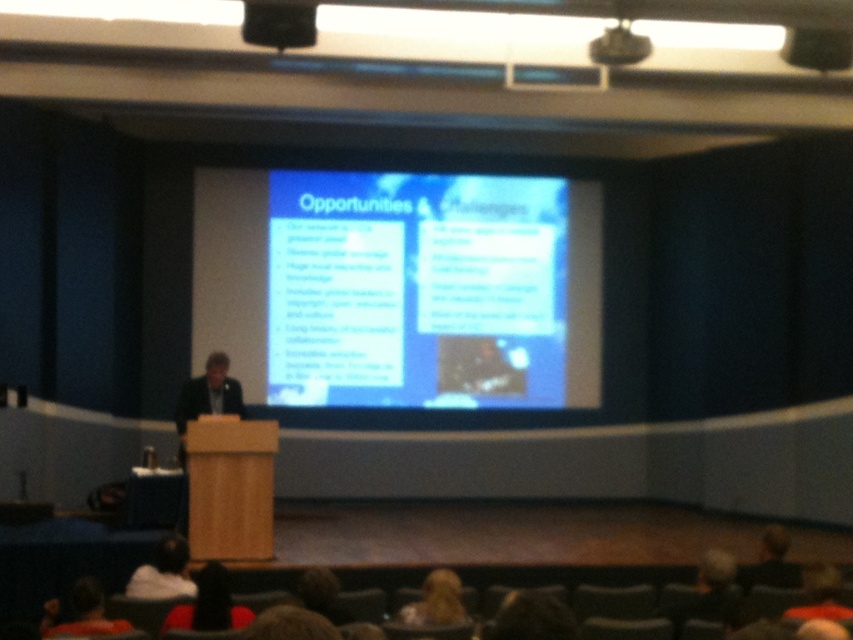
Question: Among these points, which one is farthest from the camera?

Choices:
 (A) (231, 612)
 (B) (450, 595)

Answer: (B)

Question: Does black fabric head at lower center have a smaller size compared to blonde hair at lower center?

Choices:
 (A) no
 (B) yes

Answer: (B)

Question: Is dark suit at center above blonde hair at lower center?

Choices:
 (A) yes
 (B) no

Answer: (A)

Question: Among these objects, which one is nearest to the camera?

Choices:
 (A) blue glossy projector screen at center
 (B) dark brown hair at lower center

Answer: (B)

Question: Which object is the closest to the black fabric head at lower center?

Choices:
 (A) dark brown hair at lower left
 (B) blue glossy projector screen at center
 (C) dark brown hair at lower center

Answer: (A)

Question: Does white fabric at lower left have a larger size compared to blonde hair at lower center?

Choices:
 (A) no
 (B) yes

Answer: (A)